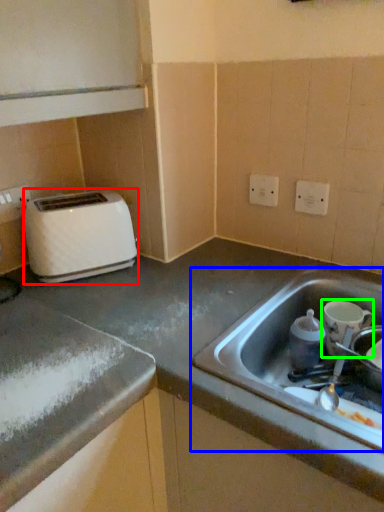
Question: Which object is positioned farthest from toaster (highlighted by a red box)? Select from sink (highlighted by a blue box) and appliance (highlighted by a green box).

Choices:
 (A) sink
 (B) appliance

Answer: (B)